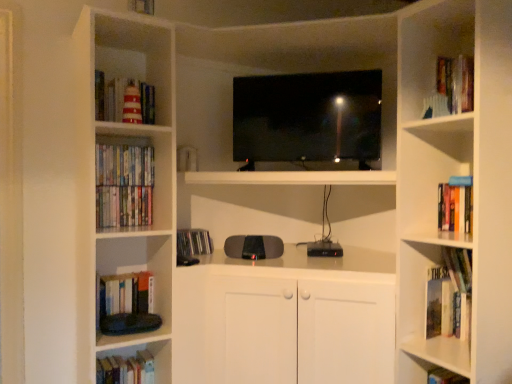
Question: Considering the positions of hardcover books at left, which is counted as the third book, starting from the top, and striped paper book at upper left, acting as the 3th book starting from the right, in the image, is hardcover books at left, which is counted as the third book, starting from the top, taller or shorter than striped paper book at upper left, acting as the 3th book starting from the right,?

Choices:
 (A) tall
 (B) short

Answer: (B)

Question: From the image's perspective, is hardcover books at left, which is the 1th book from left to right, located above or below striped paper book at upper left, placed as the 7th book when sorted from bottom to top?

Choices:
 (A) below
 (B) above

Answer: (A)

Question: Estimate the real-world distances between objects in this image. Which object is closer to the hardcover book at right, the 2th book in the right-to-left sequence?

Choices:
 (A) matte plastic dvds at left, positioned as the sixth book in right-to-left order
 (B) hardcover books at lower left, marked as the 3th book in a left-to-right arrangement
 (C) hardcover book at lower right, arranged as the 1th book when viewed from the right
 (D) hardcover books at left, the 7th book from the right
 (E) striped paper book at upper left, which ranks as the 5th book in left-to-right order

Answer: (C)

Question: Based on their relative distances, which object is farther from the hardcover books at lower left, the 2th book from the bottom?

Choices:
 (A) hardcover book at right, which is the 4th book in bottom-to-top order
 (B) striped paper book at upper left, placed as the 7th book when sorted from bottom to top
 (C) hardcover book at left, placed as the fourth book when sorted from left to right
 (D) matte plastic dvds at left, positioned as the sixth book in right-to-left order
 (E) hardcover books at left, which is the 1th book from left to right

Answer: (A)